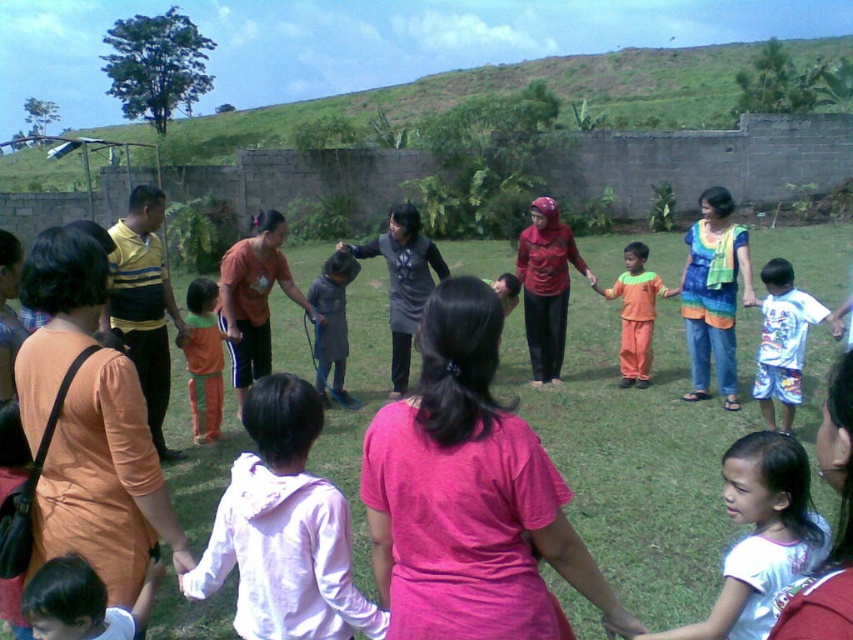
You are standing at the center of the gathering and notice two points marked in the scene. The first point is at coordinates point (160, 504) and the second is at point (328, 285). Which point is closer to you?

Point (160, 504) is in front of point (328, 285), so the first point is closer to you.

You are standing behind the group of people in the scene. You notice the green grass at center and the dark gray fabric dress at center. Which object is located to the right of the other?

The green grass at center is positioned on the right side of dark gray fabric dress at center, so the green grass at center is to the right of the dark gray fabric dress at center.

You are a photographer trying to capture a clear shot of the dark gray fabric dress at center without the green grass at center blocking it. What adjustment could you make to your camera angle or position to achieve this?

Since the green grass at center is positioned over the dark gray fabric dress at center, you can lower your camera angle to look upwards, allowing the grass to move out of the frame and reveal the dress below.